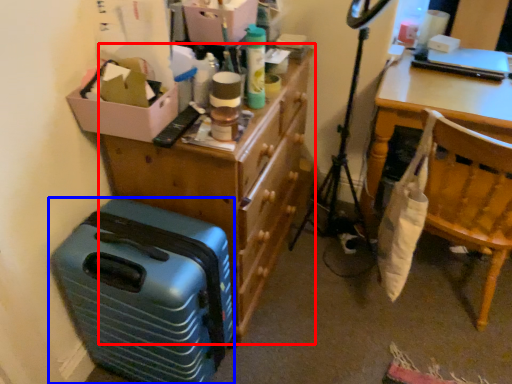
Question: Which object is further to the camera taking this photo, dresser (highlighted by a red box) or suitcase (highlighted by a blue box)?

Choices:
 (A) dresser
 (B) suitcase

Answer: (A)